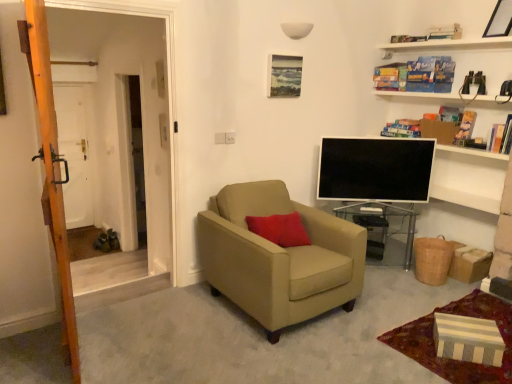
Locate an element on the screen. The width and height of the screenshot is (512, 384). empty space that is in between wooden ladder at left and beige fabric armchair at center is located at coordinates (169, 324).